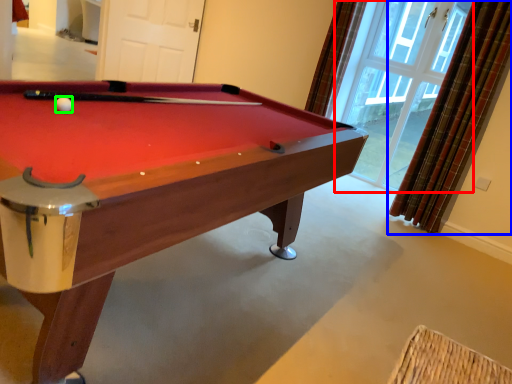
Question: Which is farther away from window (highlighted by a red box)? curtain (highlighted by a blue box) or ball (highlighted by a green box)?

Choices:
 (A) curtain
 (B) ball

Answer: (B)